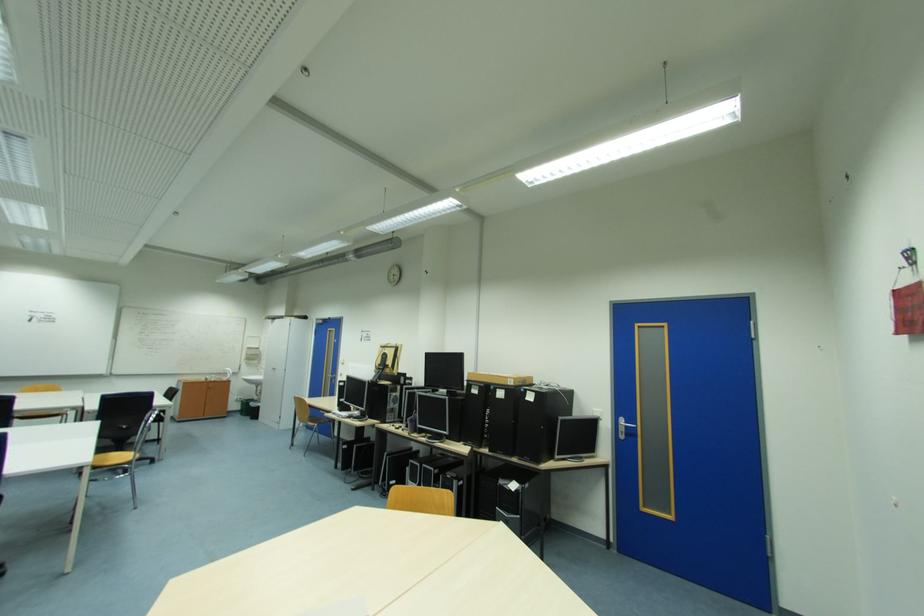
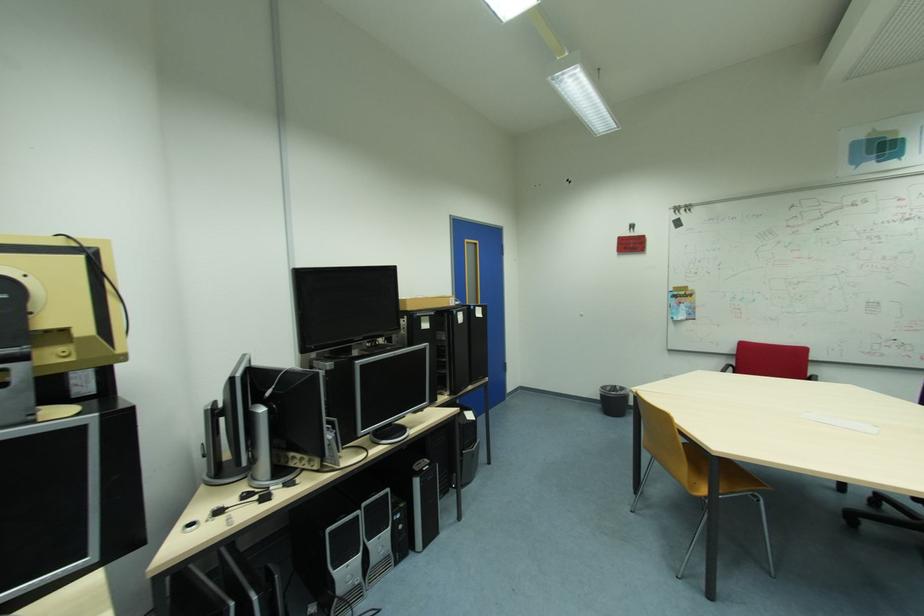
The point at [645,326] is marked in the first image. Where is the corresponding point in the second image?

(473, 241)